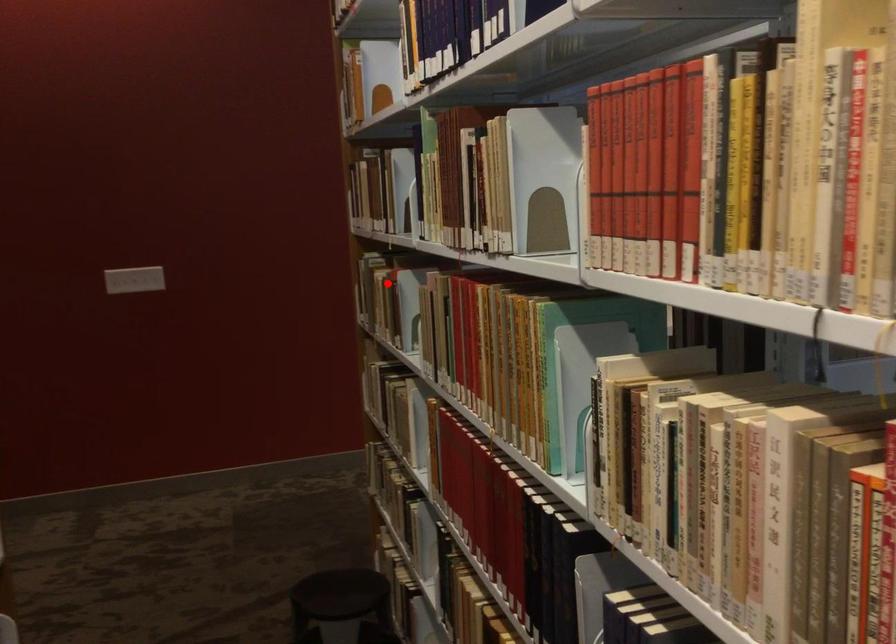
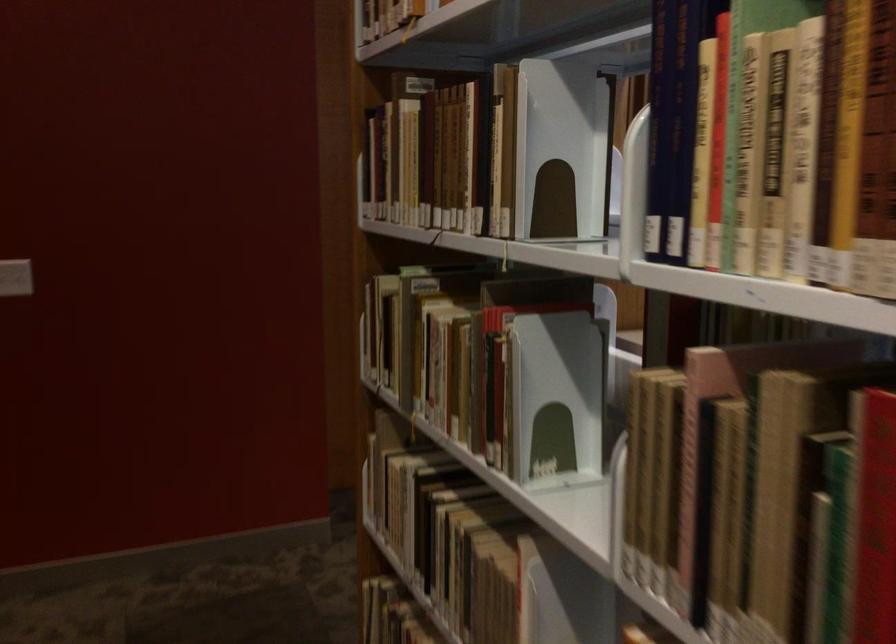
Find the pixel in the second image that matches the highlighted location in the first image.

(484, 342)